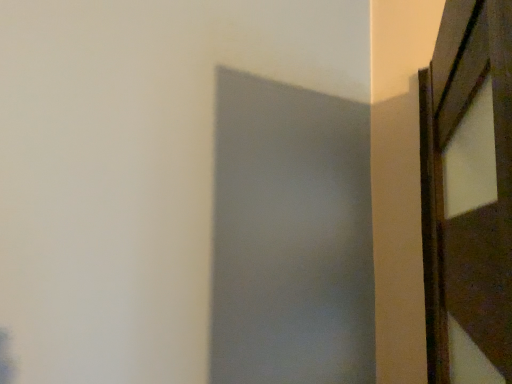
Where is `brown wooden door at right`? brown wooden door at right is located at coordinates (468, 194).

What do you see at coordinates (468, 194) in the screenshot? The image size is (512, 384). I see `brown wooden door at right` at bounding box center [468, 194].

The image size is (512, 384). Find the location of `brown wooden door at right`. brown wooden door at right is located at coordinates (468, 194).